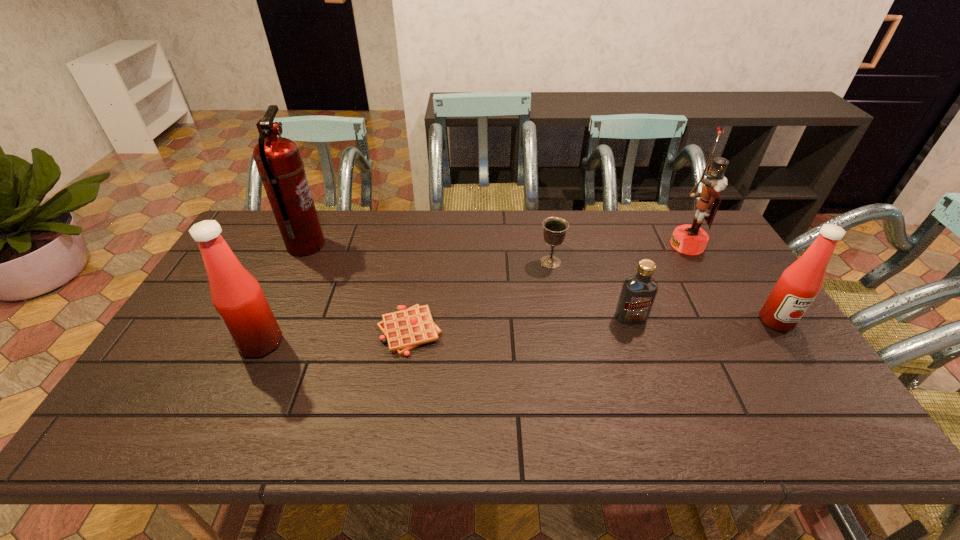
Locate an element on the screen. This screenshot has height=540, width=960. the third object from right to left is located at coordinates (638, 293).

You are a GUI agent. You are given a task and a screenshot of the screen. Output one action in this format:
    pyautogui.click(x=<x>, y=<y>)
    Task: Click on the vacant space situated 0.070m on the front-facing side of the left condiment
    
    Given the screenshot: What is the action you would take?
    pyautogui.click(x=214, y=343)

Locate an element on the screen. free location located on the front-facing side of the left condiment is located at coordinates (183, 343).

At what (x,y) coordinates should I click in order to perform the action: click on free space located on the front-facing side of the left condiment. Please return your answer as a coordinate pair (x, y). Looking at the image, I should click on (206, 343).

This screenshot has width=960, height=540. I want to click on free space located on the front-facing side of the rightmost object, so click(813, 377).

The height and width of the screenshot is (540, 960). What are the coordinates of `free space located on the front-facing side of the second object from right to left` in the screenshot? It's located at (561, 245).

The width and height of the screenshot is (960, 540). I want to click on vacant area located on the front-facing side of the second object from right to left, so click(564, 245).

You are a GUI agent. You are given a task and a screenshot of the screen. Output one action in this format:
    pyautogui.click(x=<x>, y=<y>)
    Task: Click on the vacant space located 0.290m on the front-facing side of the second object from right to left
    The width and height of the screenshot is (960, 540).
    Given the screenshot: What is the action you would take?
    pyautogui.click(x=585, y=245)

You are a GUI agent. You are given a task and a screenshot of the screen. Output one action in this format:
    pyautogui.click(x=<x>, y=<y>)
    Task: Click on the free space located on the side of the fire extinguisher with the handle and hose
    
    Given the screenshot: What is the action you would take?
    [x=436, y=246]

Find the location of a particular element. vacant space situated 0.290m on the right of the fifth object from right to left is located at coordinates (549, 331).